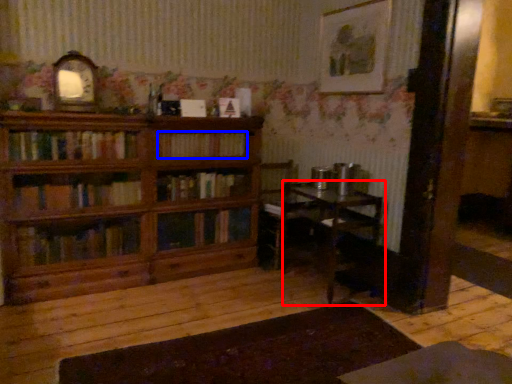
Question: Which of the following is the farthest to the observer, table (highlighted by a red box) or book (highlighted by a blue box)?

Choices:
 (A) table
 (B) book

Answer: (B)